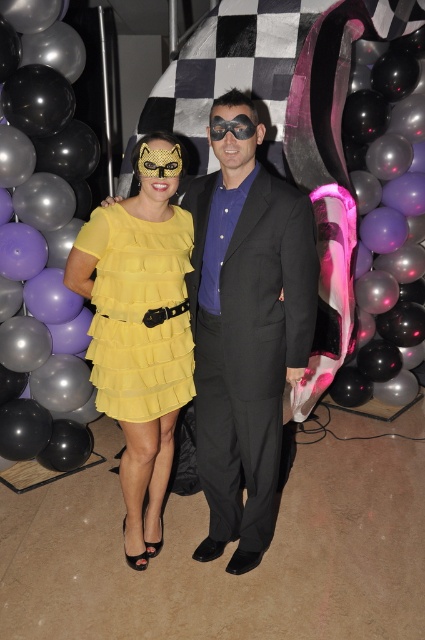
Is point (235, 92) positioned before point (8, 454)?

That is True.

Is yellow fabric dress at center bigger than black glossy balloon at left?

No.

Between point (229, 312) and point (47, 435), which one is positioned in front?

Point (229, 312)

This screenshot has height=640, width=425. What are the coordinates of `yellow fabric dress at center` in the screenshot? It's located at (246, 326).

Does black glossy balloon at left have a greater height compared to yellow tulle dress at center?

Yes, black glossy balloon at left is taller than yellow tulle dress at center.

The width and height of the screenshot is (425, 640). What do you see at coordinates (42, 248) in the screenshot?
I see `black glossy balloon at left` at bounding box center [42, 248].

Describe the element at coordinates (42, 248) in the screenshot. The height and width of the screenshot is (640, 425). I see `black glossy balloon at left` at that location.

Find the location of a particular element. The image size is (425, 640). black glossy balloon at left is located at coordinates (42, 248).

Which of these two, yellow fabric dress at center or yellow chiffon dress at center, stands shorter?

yellow chiffon dress at center is shorter.

Between point (206, 392) and point (99, 385), which one is positioned in front?

Point (99, 385) is more forward.

I want to click on yellow fabric dress at center, so click(246, 326).